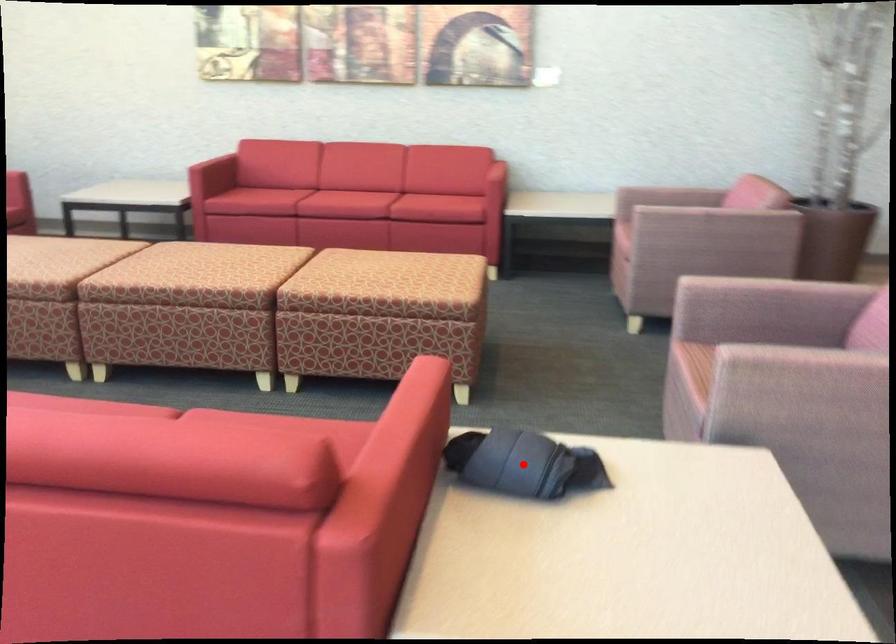
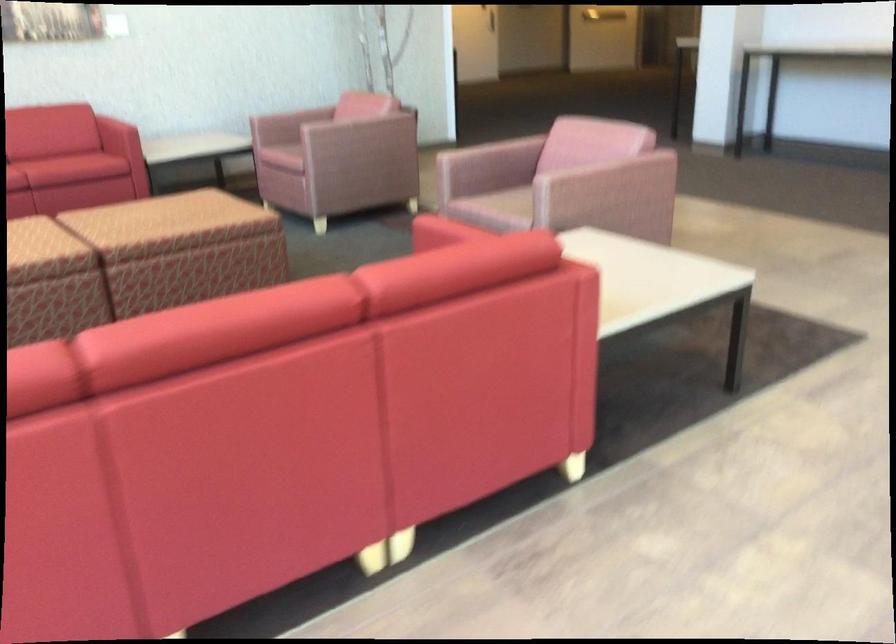
Question: I am providing you with two images of the same scene from different viewpoints. A red point is marked on the first image. Can you still see the location of the red point in image 2?

Choices:
 (A) Yes
 (B) No

Answer: (B)